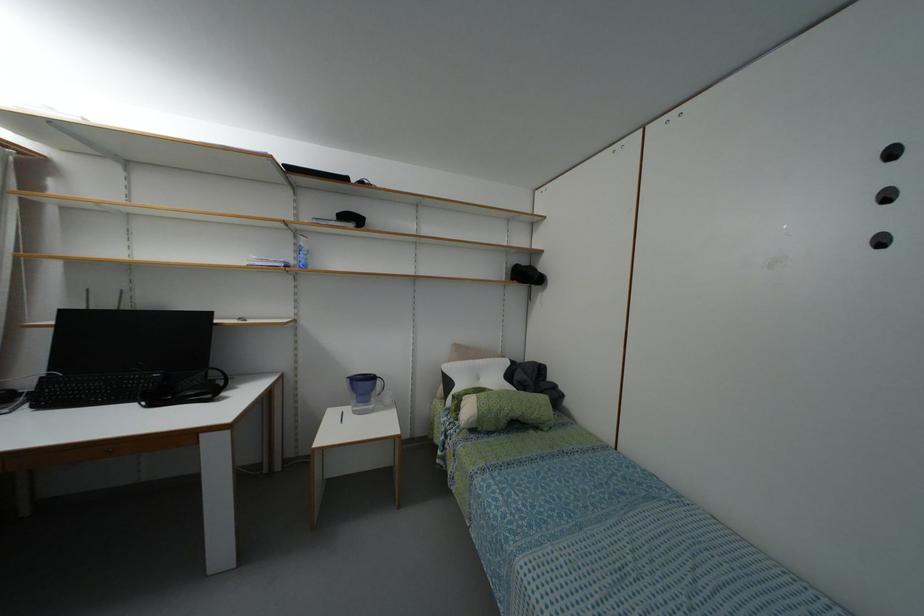
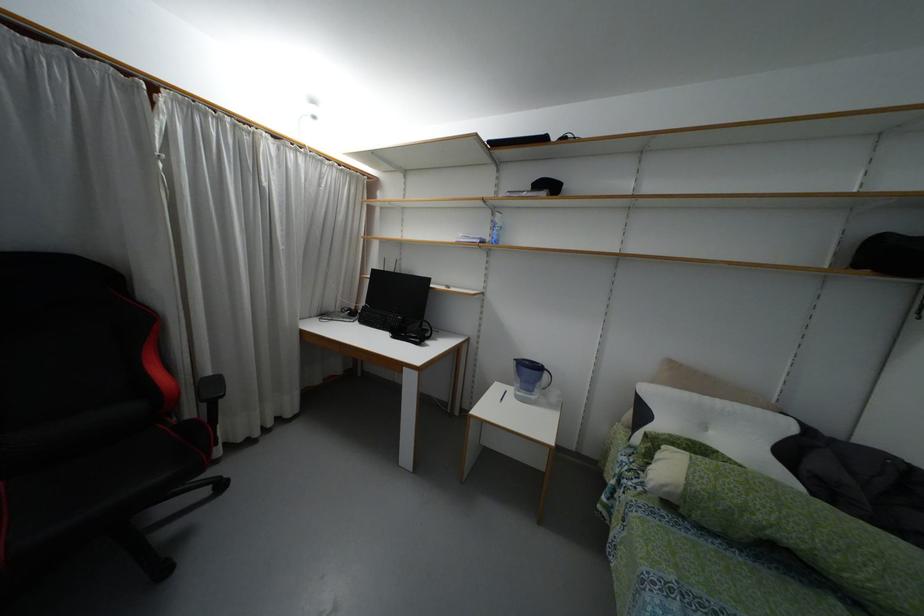
Where in the second image is the point corresponding to pixel 378 382 from the first image?

(544, 375)